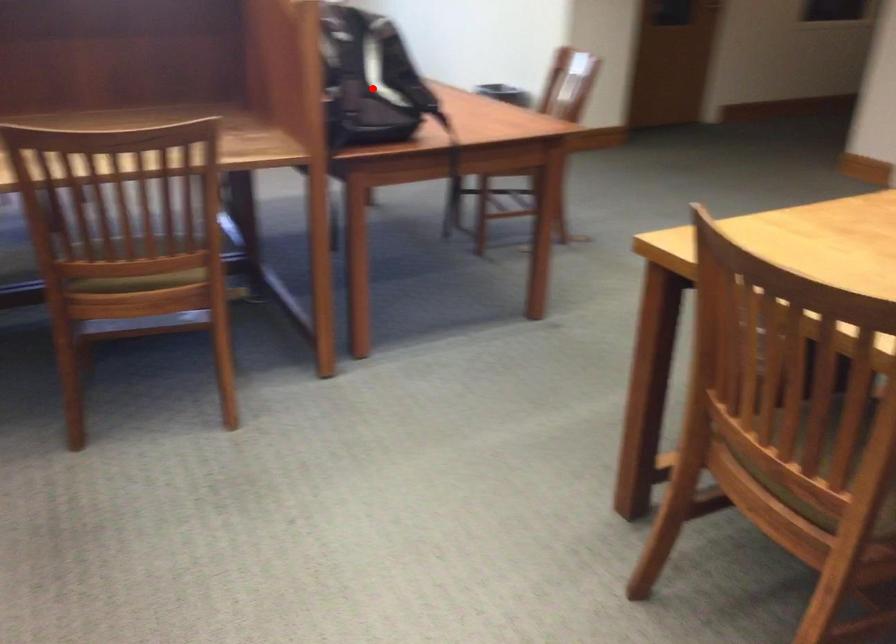
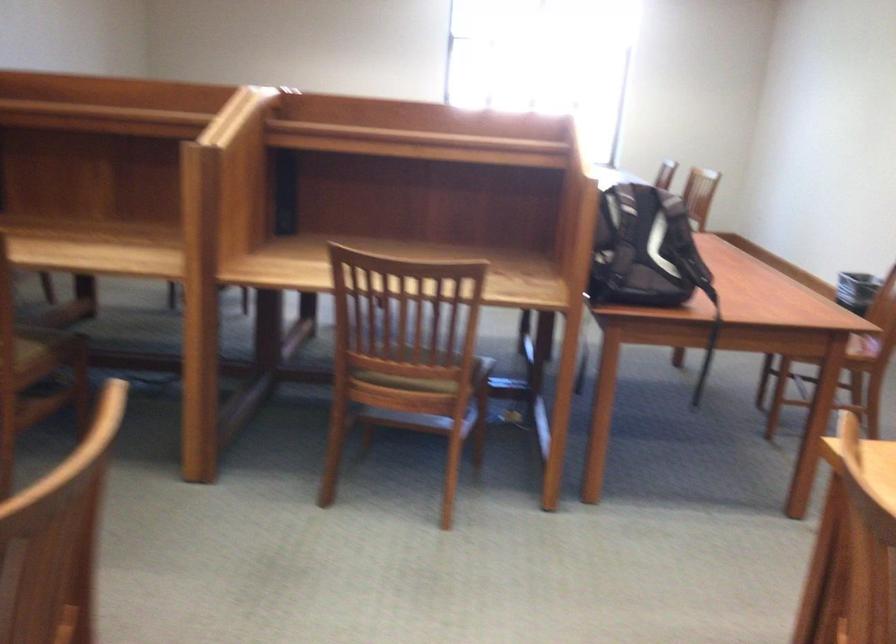
Locate, in the second image, the point that corresponds to the highlighted location in the first image.

(644, 250)